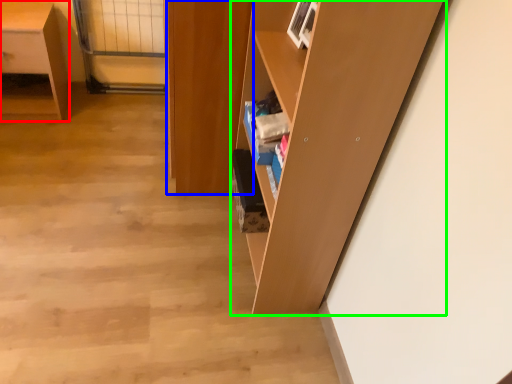
Question: Which object is the closest to the desk (highlighted by a red box)? Choose among these: cabinetry (highlighted by a blue box) or shelf (highlighted by a green box).

Choices:
 (A) cabinetry
 (B) shelf

Answer: (A)